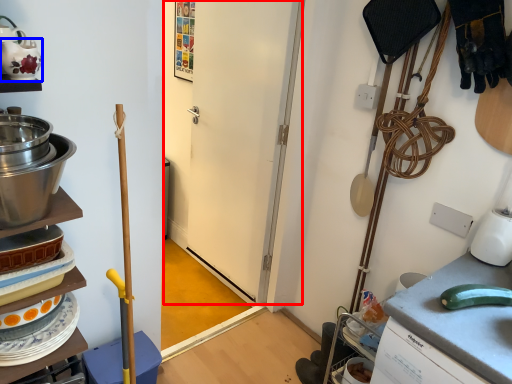
Question: Among these objects, which one is farthest to the camera, door (highlighted by a red box) or tea pot (highlighted by a blue box)?

Choices:
 (A) door
 (B) tea pot

Answer: (A)